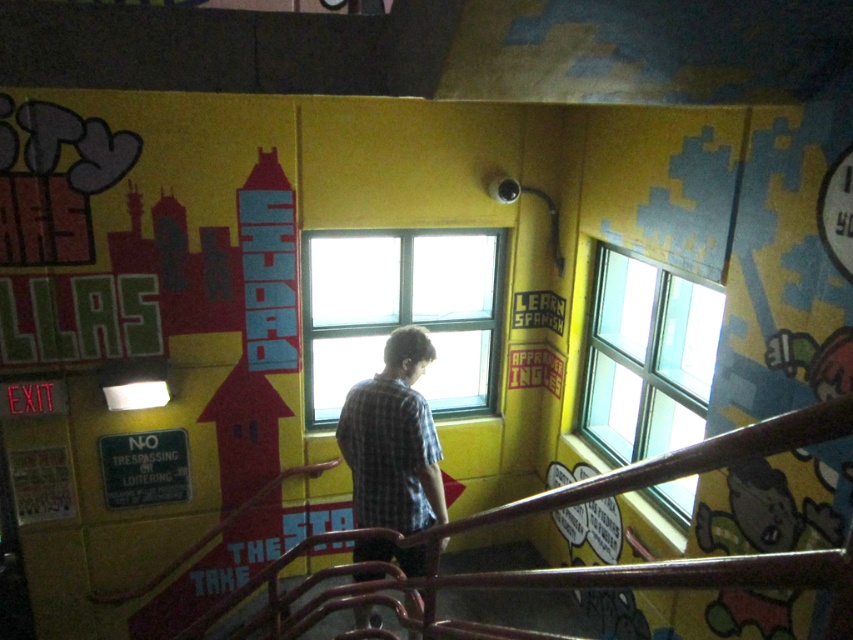
Does point (432, 605) come in front of point (421, 362)?

That is True.

Identify the location of rusty metal railing at center. Image resolution: width=853 pixels, height=640 pixels. (566, 566).

This screenshot has height=640, width=853. Find the location of `rusty metal railing at center`. rusty metal railing at center is located at coordinates (566, 566).

Does rusty metal railing at center have a greater height compared to clear glass window at upper center?

Yes, rusty metal railing at center is taller than clear glass window at upper center.

How much distance is there between rusty metal railing at center and clear glass window at upper center?

They are 5.36 feet apart.

Where is `rusty metal railing at center`? rusty metal railing at center is located at coordinates (566, 566).

Between rusty metal railing at center and clear glass window at center, which one is positioned higher?

clear glass window at center is above.

Who is shorter, rusty metal railing at center or clear glass window at center?

With less height is clear glass window at center.

Is point (262, 616) farther from viewer compared to point (489, 364)?

No.

You are a GUI agent. You are given a task and a screenshot of the screen. Output one action in this format:
    pyautogui.click(x=<x>, y=<y>)
    Task: Click on the rusty metal railing at center
    
    Given the screenshot: What is the action you would take?
    click(x=566, y=566)